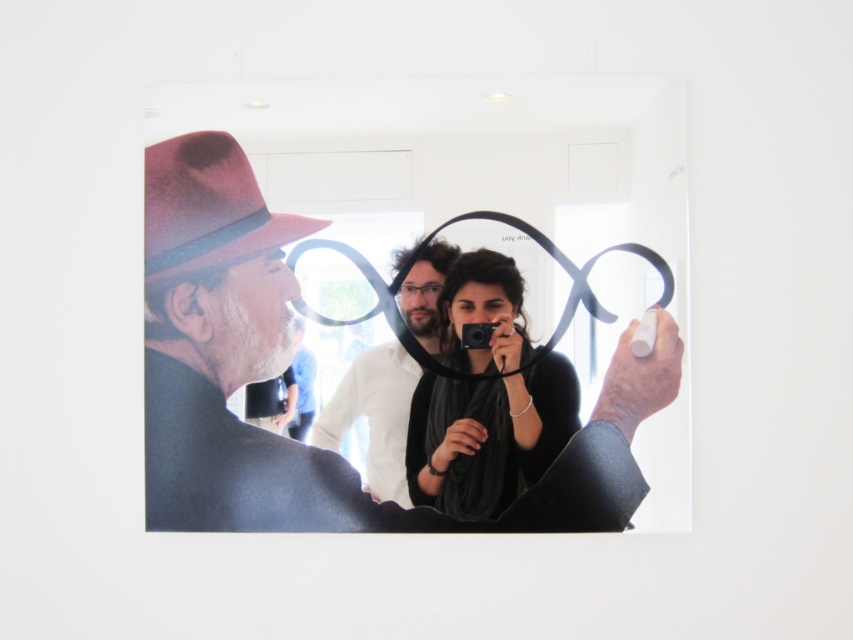
You are an art curator examining the photograph on the wall. You notice the white matte shirt at center and the black plastic camera at center. Which object is positioned lower in the image?

The white matte shirt at center is located below the black plastic camera at center, so it is positioned lower in the image.

You are an art curator examining the installation. You need to determine if the matte black suit at center can fully cover the matte black camera at center if placed directly over it. Based on their sizes, what do you conclude?

The matte black suit at center might be wider than the matte black camera at center, so it could potentially cover the camera if positioned correctly.